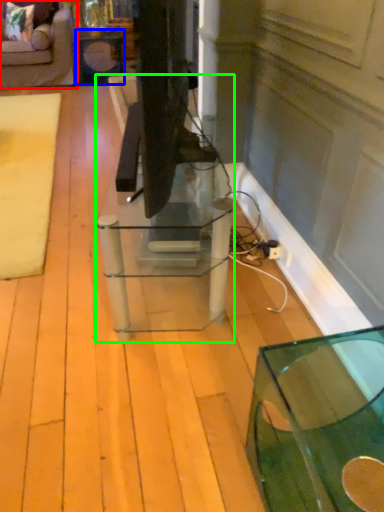
Question: Which object is the closest to the furniture (highlighted by a red box)? Choose among these: side table (highlighted by a blue box) or table (highlighted by a green box).

Choices:
 (A) side table
 (B) table

Answer: (A)